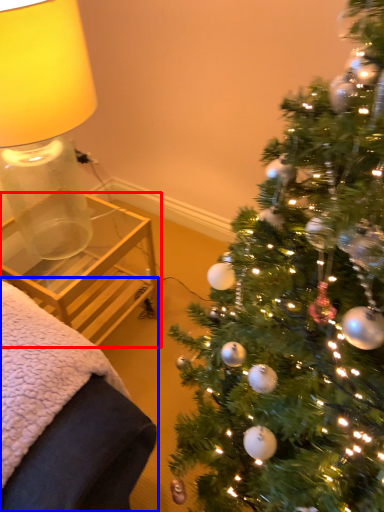
Question: Which object appears closest to the camera in this image, table (highlighted by a red box) or furniture (highlighted by a blue box)?

Choices:
 (A) table
 (B) furniture

Answer: (B)